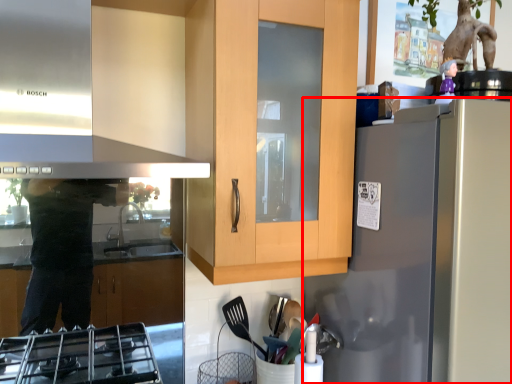
Question: From the image's perspective, what is the correct spatial positioning of refrigerator (annotated by the red box) in reference to exhaust hood?

Choices:
 (A) above
 (B) below

Answer: (B)